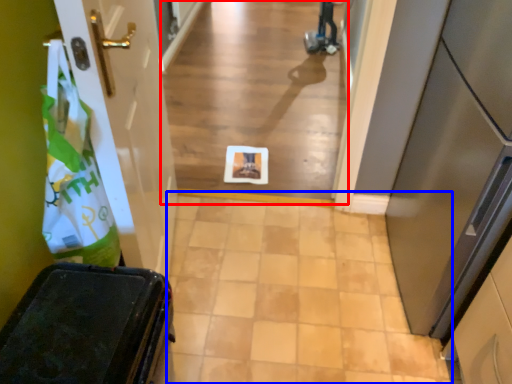
Question: Which point is closer to the camera, alley (highlighted by a red box) or path (highlighted by a blue box)?

Choices:
 (A) alley
 (B) path

Answer: (B)